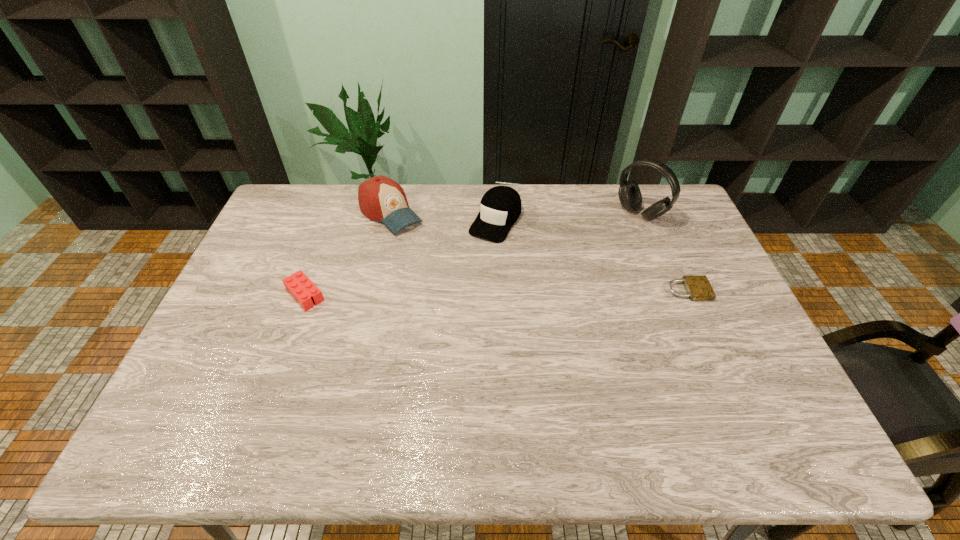
At what (x,y) coordinates should I click in order to perform the action: click on the second shortest object. Please return your answer as a coordinate pair (x, y). Looking at the image, I should click on (298, 284).

Image resolution: width=960 pixels, height=540 pixels. I want to click on the leftmost object, so click(x=298, y=284).

This screenshot has height=540, width=960. I want to click on the shortest object, so click(x=698, y=288).

I want to click on the fourth shortest object, so click(380, 198).

At what (x,y) coordinates should I click in order to perform the action: click on the second object from left to right. Please return your answer as a coordinate pair (x, y). This screenshot has width=960, height=540. Looking at the image, I should click on pos(380,198).

Where is `headset`? headset is located at coordinates (629, 193).

The width and height of the screenshot is (960, 540). What are the coordinates of `the third tallest object` in the screenshot? It's located at coord(500,207).

Image resolution: width=960 pixels, height=540 pixels. I want to click on the third object from right to left, so click(500, 207).

Find the location of a particular element. The image size is (960, 540). free point located 0.200m on the back of the second shortest object is located at coordinates (326, 235).

The height and width of the screenshot is (540, 960). In order to click on vacant point located 0.240m on the front-facing side of the second tallest object in this screenshot , I will do tap(451, 270).